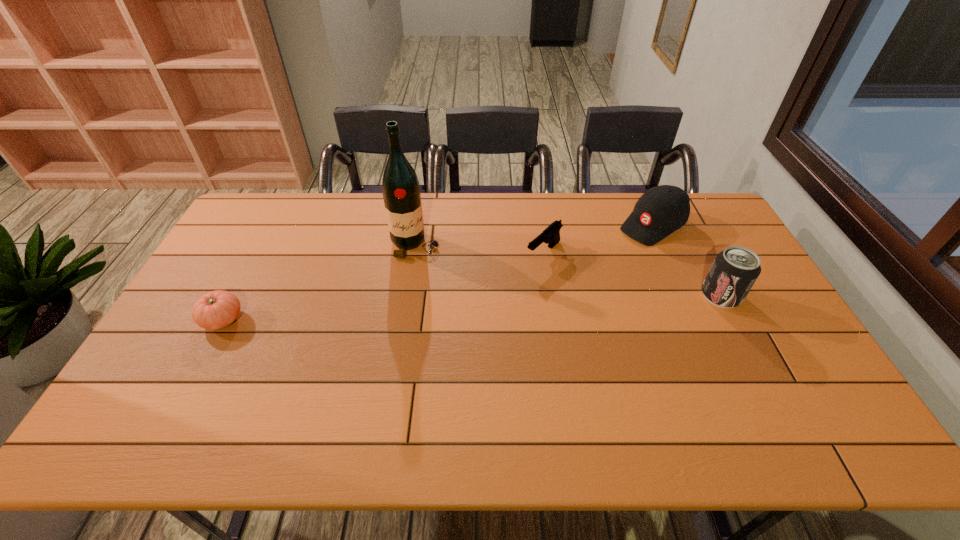
The height and width of the screenshot is (540, 960). What are the coordinates of `vacant space that is in between the tomato and the soda can` in the screenshot? It's located at (472, 308).

Identify the location of empty space between the soda can and the tomato. (472, 308).

Identify the location of free point between the soda can and the leftmost object. (472, 308).

Find the location of `free space between the leftmost object and the third tallest object`. free space between the leftmost object and the third tallest object is located at coordinates (438, 273).

The width and height of the screenshot is (960, 540). What are the coordinates of `vacant area that lies between the baseball cap and the tallest object` in the screenshot? It's located at (534, 235).

I want to click on vacant point located between the tallest object and the soda can, so click(x=568, y=270).

Find the location of `the closest object to the wine bottle`. the closest object to the wine bottle is located at coordinates (551, 235).

You are a GUI agent. You are given a task and a screenshot of the screen. Output one action in this format:
    pyautogui.click(x=<x>, y=<y>)
    Task: Click on the object that is the third closest to the soda can
    Image resolution: width=960 pixels, height=540 pixels.
    Given the screenshot: What is the action you would take?
    pyautogui.click(x=400, y=187)

You are a GUI agent. You are given a task and a screenshot of the screen. Output one action in this format:
    pyautogui.click(x=<x>, y=<y>)
    Task: Click on the vacant space that satisfies the following two spatial constraints: 1. on the front side of the soda can; 2. on the left side of the tallest object
    The image size is (960, 540).
    Given the screenshot: What is the action you would take?
    pyautogui.click(x=407, y=296)

Locate an element on the screen. free spot that satisfies the following two spatial constraints: 1. on the front side of the pistol; 2. on the left side of the tallest object is located at coordinates (414, 253).